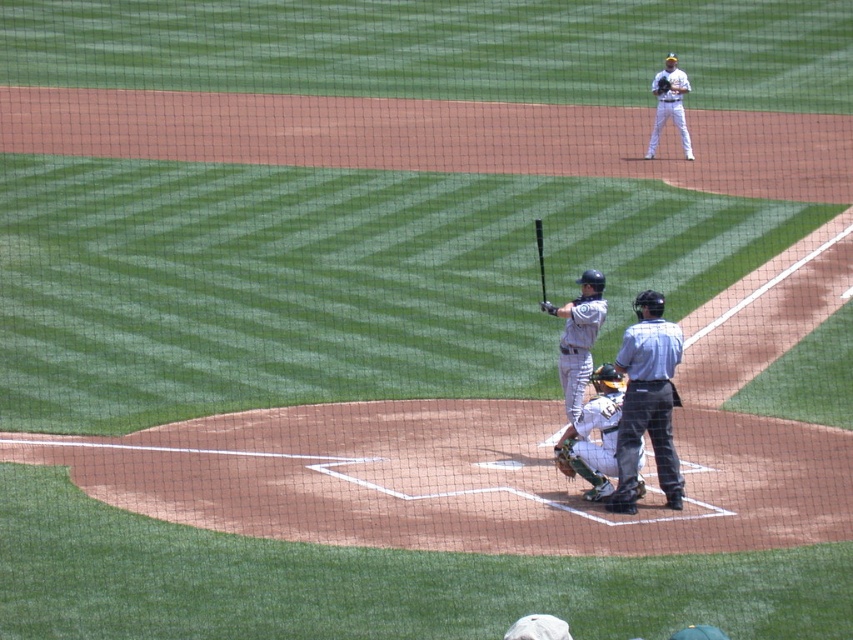
Does gray uniform at center have a lesser width compared to matte black bat at center?

No, gray uniform at center is not thinner than matte black bat at center.

Who is more forward, (x=646, y=310) or (x=538, y=225)?

Positioned in front is point (x=646, y=310).

Find the location of `gray uniform at center`. gray uniform at center is located at coordinates (647, 403).

Does gray uniform at center have a greater height compared to gray uniform bat at center?

Yes.

Which is more to the left, gray uniform at center or gray uniform bat at center?

From the viewer's perspective, gray uniform bat at center appears more on the left side.

Who is more forward, (x=653, y=339) or (x=578, y=333)?

Point (x=653, y=339) is in front.

I want to click on gray uniform at center, so click(x=647, y=403).

What are the coordinates of `brown leather glove at home plate` in the screenshot? It's located at (563, 458).

What do you see at coordinates (563, 458) in the screenshot? I see `brown leather glove at home plate` at bounding box center [563, 458].

At what (x,y) coordinates should I click in order to perform the action: click on brown leather glove at home plate. Please return your answer as a coordinate pair (x, y). The image size is (853, 640). Looking at the image, I should click on (563, 458).